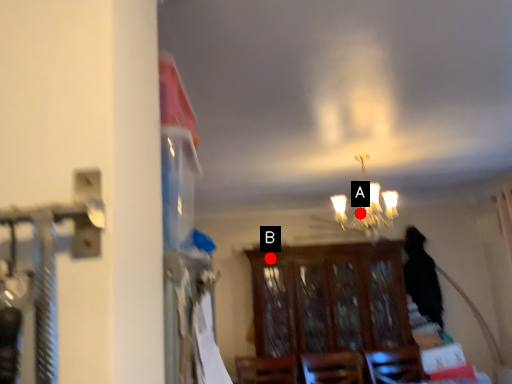
Question: Two points are circled on the image, labeled by A and B beside each circle. Which of the following is the closest to the observer?

Choices:
 (A) A is closer
 (B) B is closer

Answer: (A)